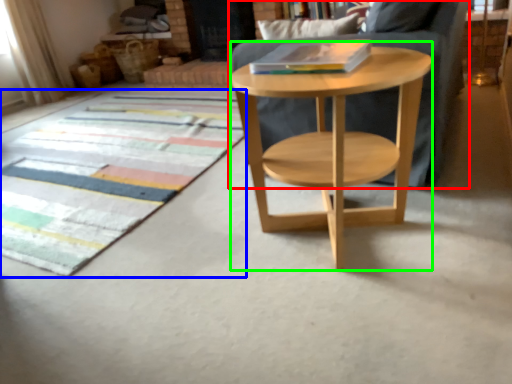
Question: Considering the real-world distances, which object is farthest from chair (highlighted by a red box)? mat (highlighted by a blue box) or round table (highlighted by a green box)?

Choices:
 (A) mat
 (B) round table

Answer: (A)